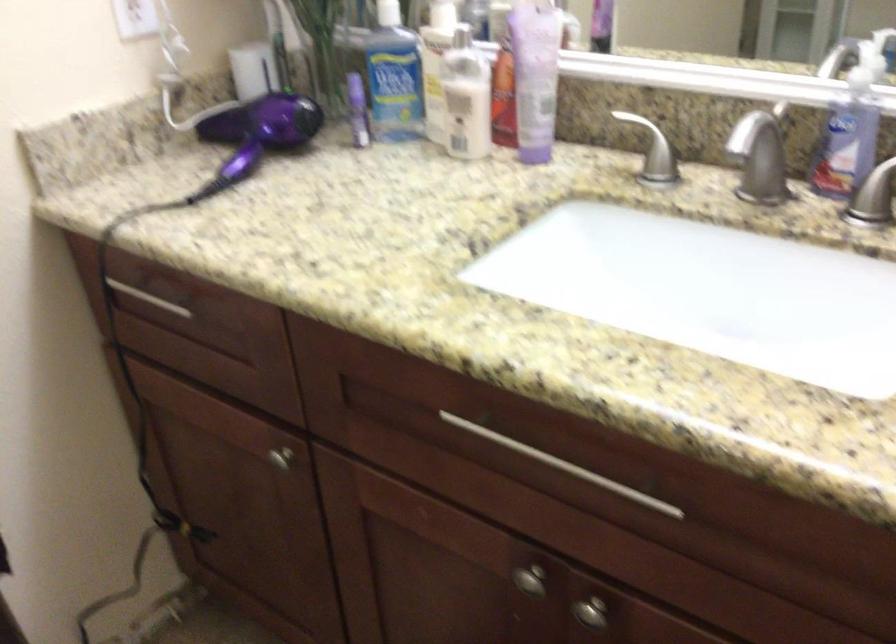
Locate an element on the screen. blue plastic bottle is located at coordinates (846, 145).